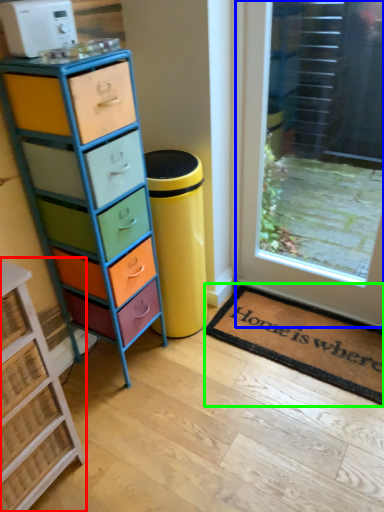
Question: Which object is the closest to the chest of drawers (highlighted by a red box)? Choose among these: door (highlighted by a blue box) or doormat (highlighted by a green box).

Choices:
 (A) door
 (B) doormat

Answer: (B)